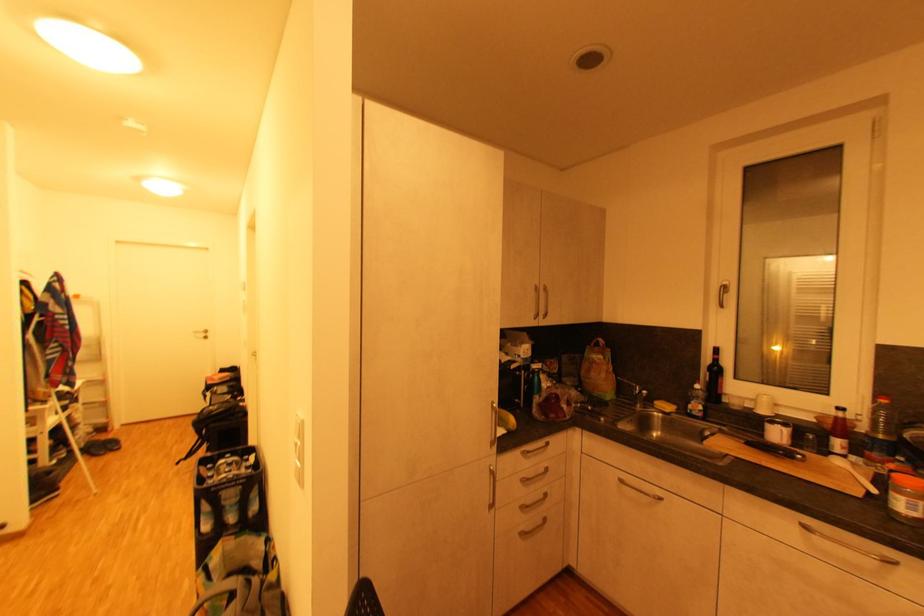
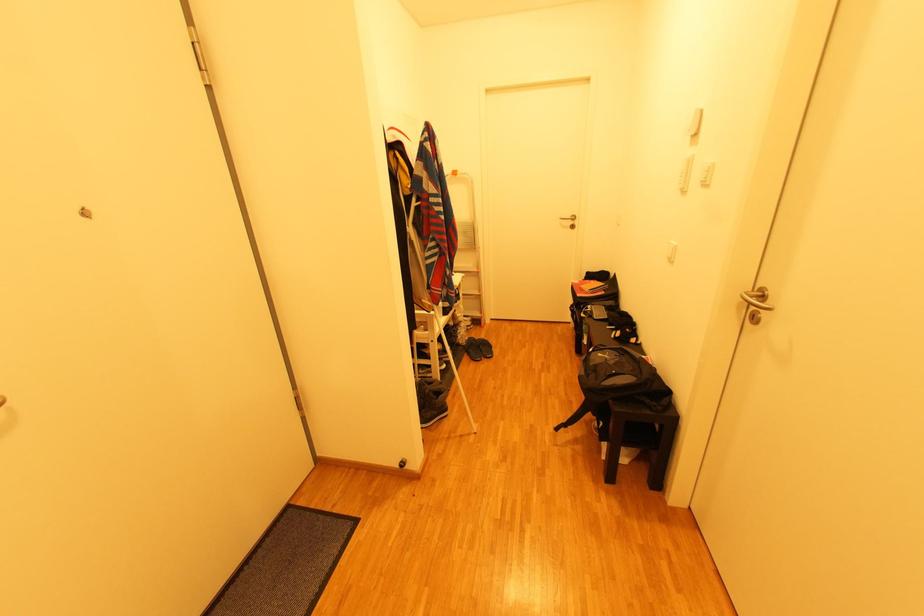
The point at (107, 421) is marked in the first image. Where is the corresponding point in the second image?

(481, 315)